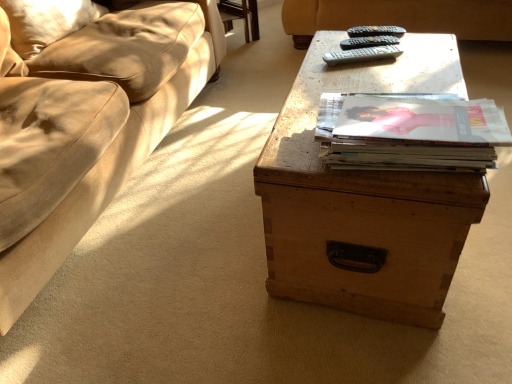
Question: From a real-world perspective, is suede-like beige pillow at upper left below wooden trunk at center?

Choices:
 (A) no
 (B) yes

Answer: (A)

Question: Can you confirm if suede-like beige pillow at upper left is thinner than wooden trunk at center?

Choices:
 (A) no
 (B) yes

Answer: (B)

Question: Is suede-like beige pillow at upper left not close to wooden trunk at center?

Choices:
 (A) yes
 (B) no

Answer: (A)

Question: Is suede-like beige pillow at upper left behind wooden trunk at center?

Choices:
 (A) no
 (B) yes

Answer: (B)

Question: Considering the relative sizes of suede-like beige pillow at upper left and wooden trunk at center in the image provided, is suede-like beige pillow at upper left shorter than wooden trunk at center?

Choices:
 (A) no
 (B) yes

Answer: (B)

Question: Is black plastic remote at upper center, arranged as the 2th remote when viewed from the top, to the left or to the right of gray plastic remote at upper center, which ranks as the first remote in bottom-to-top order, in the image?

Choices:
 (A) left
 (B) right

Answer: (B)

Question: Which is correct: black plastic remote at upper center, arranged as the 2th remote when viewed from the top, is inside gray plastic remote at upper center, which ranks as the first remote in bottom-to-top order, or outside of it?

Choices:
 (A) outside
 (B) inside

Answer: (A)

Question: Looking at their shapes, would you say black plastic remote at upper center, the second remote when ordered from bottom to top, is wider or thinner than gray plastic remote at upper center, which ranks as the first remote in bottom-to-top order?

Choices:
 (A) wide
 (B) thin

Answer: (B)

Question: Based on their sizes in the image, would you say black plastic remote at upper center, the second remote when ordered from bottom to top, is bigger or smaller than gray plastic remote at upper center, which ranks as the 3th remote in top-to-bottom order?

Choices:
 (A) big
 (B) small

Answer: (A)

Question: In terms of size, does gray plastic remote at upper center, which ranks as the first remote in bottom-to-top order, appear bigger or smaller than matte paper stack of magazines at center?

Choices:
 (A) small
 (B) big

Answer: (A)

Question: Based on their positions, is gray plastic remote at upper center, which ranks as the first remote in bottom-to-top order, located to the left or right of matte paper stack of magazines at center?

Choices:
 (A) left
 (B) right

Answer: (B)

Question: Is gray plastic remote at upper center, which ranks as the first remote in bottom-to-top order, inside the boundaries of matte paper stack of magazines at center, or outside?

Choices:
 (A) inside
 (B) outside

Answer: (B)

Question: Is point (376, 56) positioned closer to the camera than point (419, 135)?

Choices:
 (A) farther
 (B) closer

Answer: (A)

Question: Based on their sizes in the image, would you say gray plastic remote at upper center, which ranks as the 3th remote in top-to-bottom order, is bigger or smaller than suede-like beige pillow at upper left?

Choices:
 (A) small
 (B) big

Answer: (A)

Question: Considering the positions of point (400, 49) and point (12, 44), is point (400, 49) closer or farther from the camera than point (12, 44)?

Choices:
 (A) closer
 (B) farther

Answer: (A)